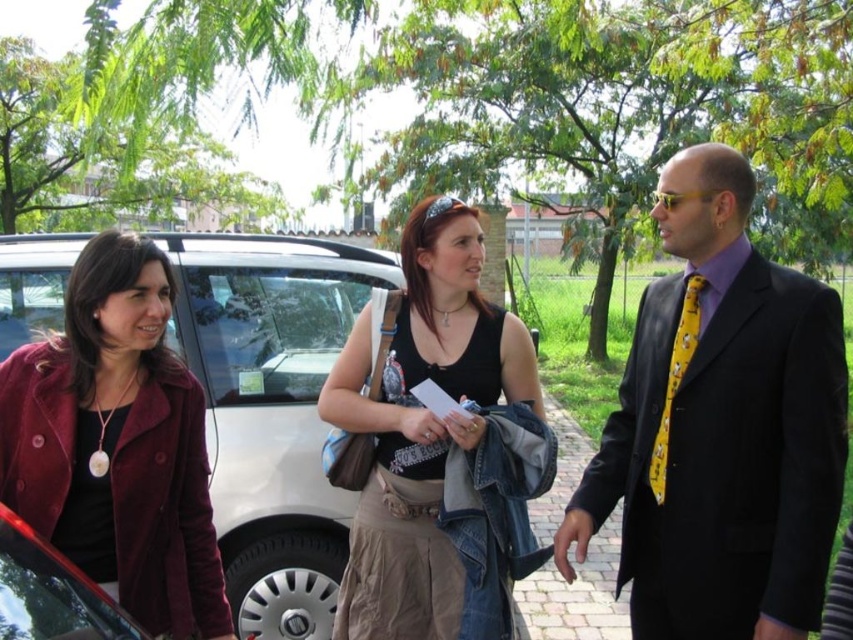
Question: Which of the following is the closest to the observer?

Choices:
 (A) metallic red car at lower left
 (B) yellow printed tie at right

Answer: (A)

Question: Which of the following is the farthest from the observer?

Choices:
 (A) metallic red car at lower left
 (B) silver metallic car at center

Answer: (B)

Question: Does silver metallic car at center have a lesser width compared to brick pavement at center?

Choices:
 (A) no
 (B) yes

Answer: (A)

Question: Which object is the farthest from the matte black suit at center?

Choices:
 (A) silver metallic car at center
 (B) black fabric tank top at center

Answer: (A)

Question: Does silver metallic car at center appear on the left side of velvet maroon coat at left?

Choices:
 (A) yes
 (B) no

Answer: (B)

Question: In this image, where is matte black suit at center located relative to metallic red car at lower left?

Choices:
 (A) above
 (B) below

Answer: (A)